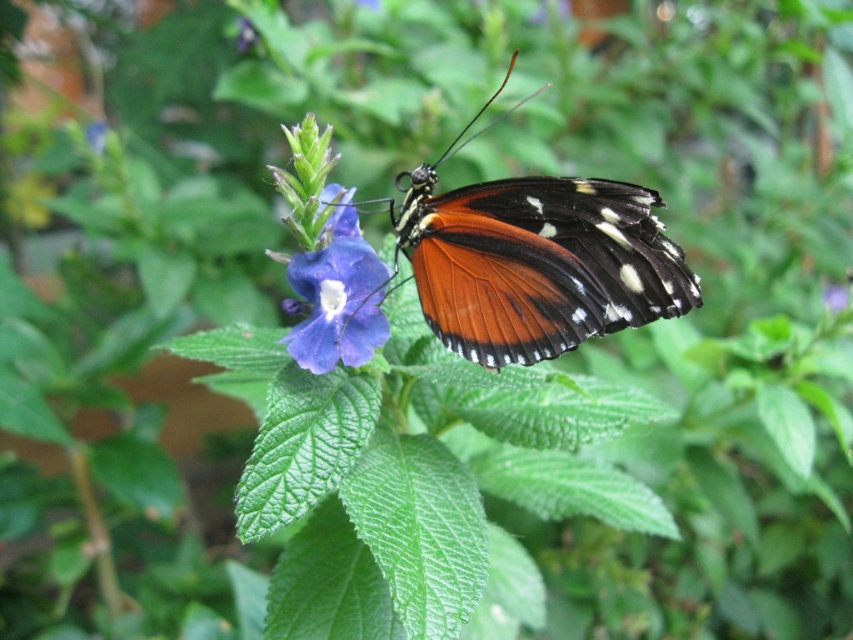
You are a gardener who wants to place a 5 inch ruler between the orange matte butterfly at center and the matte purple flower at center. Can the ruler fit entirely between them?

The distance between the orange matte butterfly at center and the matte purple flower at center is 4.85 inches. Since the ruler is 5 inches long, it cannot fit entirely between them as the space is slightly shorter than the ruler.

You are a gardener who wants to take a photo of the orange matte butterfly at center and the matte purple flower at center. Which object should you focus on first if you want to capture both clearly in the same frame?

The orange matte butterfly at center is bigger than the matte purple flower at center, so you should focus on the orange matte butterfly at center first to ensure both are in focus.

You are an entomologist observing the orange matte butterfly at center and the matte purple flower at center in the garden. Which object is taller?

The orange matte butterfly at center is much taller than the matte purple flower at center.